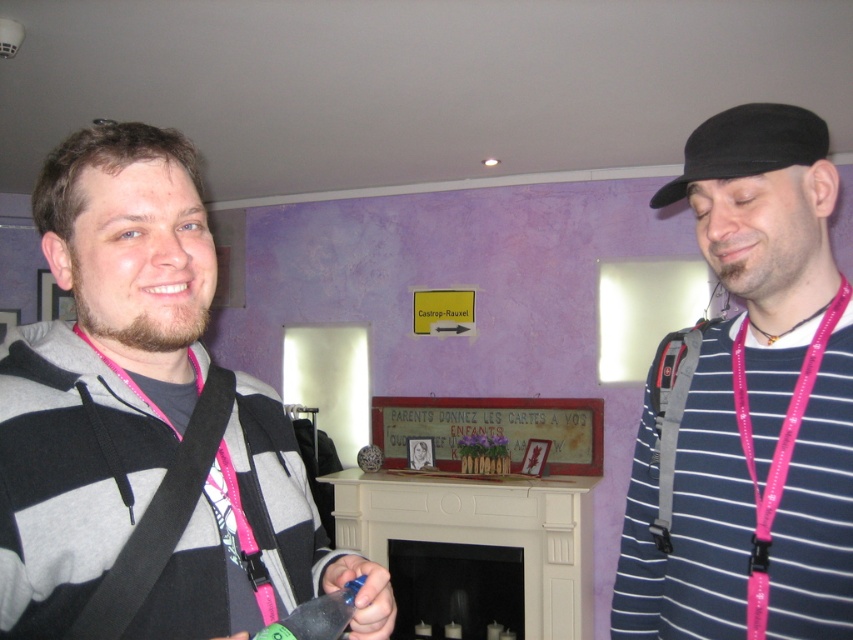
You are a photographer setting up a shot. You have a camera with a 5 inch wide lens. You want to frame both the striped cotton shirt at right and the pink lanyard at center in the same shot. Can you fit both into the frame without moving the camera?

The striped cotton shirt at right and pink lanyard at center are 6.07 inches apart from each other. Since the lens is only 5 inches wide, the distance between them exceeds the lens width, so you cannot fit both into the frame without moving the camera.

You are standing at point (x=148, y=428) in the image. What object is located exactly at your current position?

The gray hoodie at center is located exactly at point (x=148, y=428).

You are taking a photo of two people standing in front of a purple wall. You notice two points marked at coordinates point (78, 237) and point (206, 467). Which point is nearer to the camera?

Point (78, 237) is closer to the camera than point (206, 467).